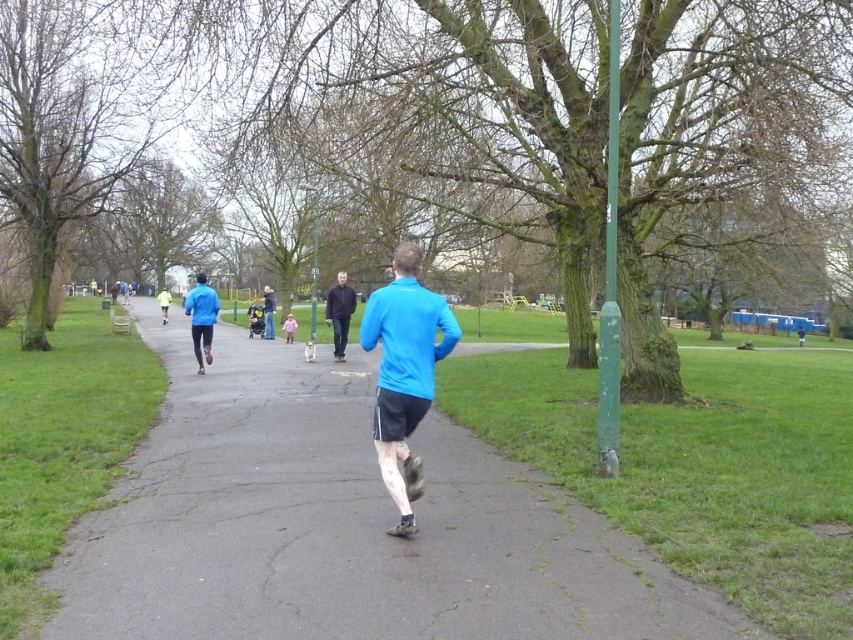
Question: Which of the following is the closest to the observer?

Choices:
 (A) blue fabric jacket at center
 (B) neon yellow jacket at center
 (C) dark brown leather jacket at center
 (D) blue matte jacket at center

Answer: (D)

Question: Is blue matte jacket at center to the right of pink fabric child at center from the viewer's perspective?

Choices:
 (A) yes
 (B) no

Answer: (A)

Question: Which of the following is the closest to the observer?

Choices:
 (A) (390, 387)
 (B) (738, 616)

Answer: (B)

Question: Considering the real-world distances, which object is farthest from the blue fabric jacket at center?

Choices:
 (A) blue matte jacket at center
 (B) neon yellow jacket at center
 (C) smooth asphalt path at center

Answer: (B)

Question: Is smooth asphalt path at center positioned before blue matte jacket at center?

Choices:
 (A) yes
 (B) no

Answer: (A)

Question: Where is neon yellow jacket at center located in relation to pink fabric child at center in the image?

Choices:
 (A) above
 (B) below

Answer: (A)